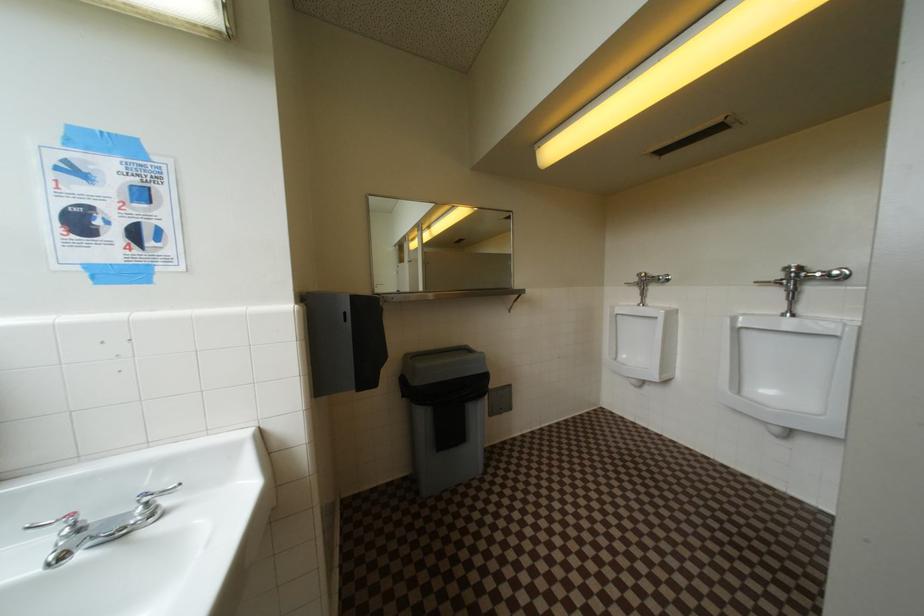
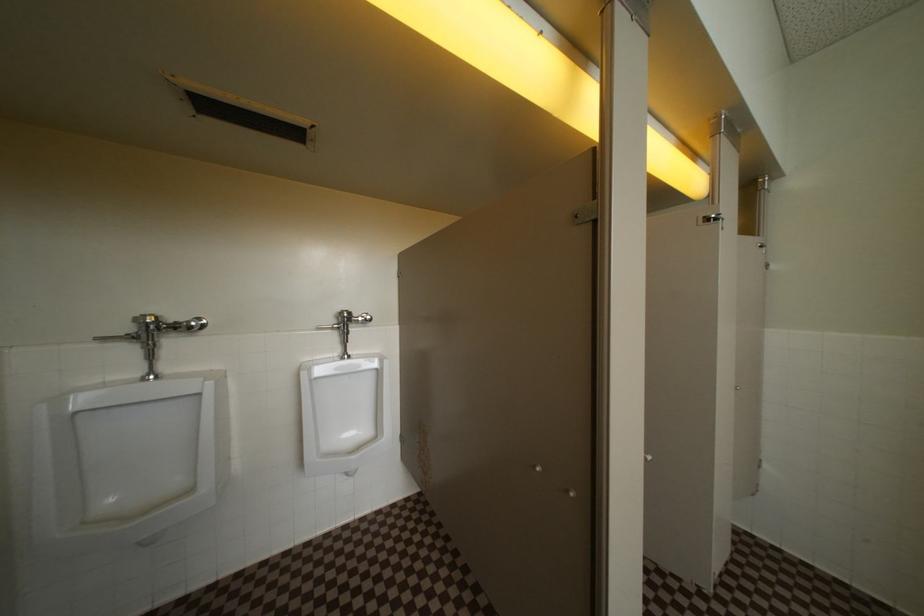
Question: Based on the continuous images, in which direction is the camera rotating? Reply with the corresponding letter.

Choices:
 (A) Left
 (B) Right
 (C) Up
 (D) Down

Answer: (B)